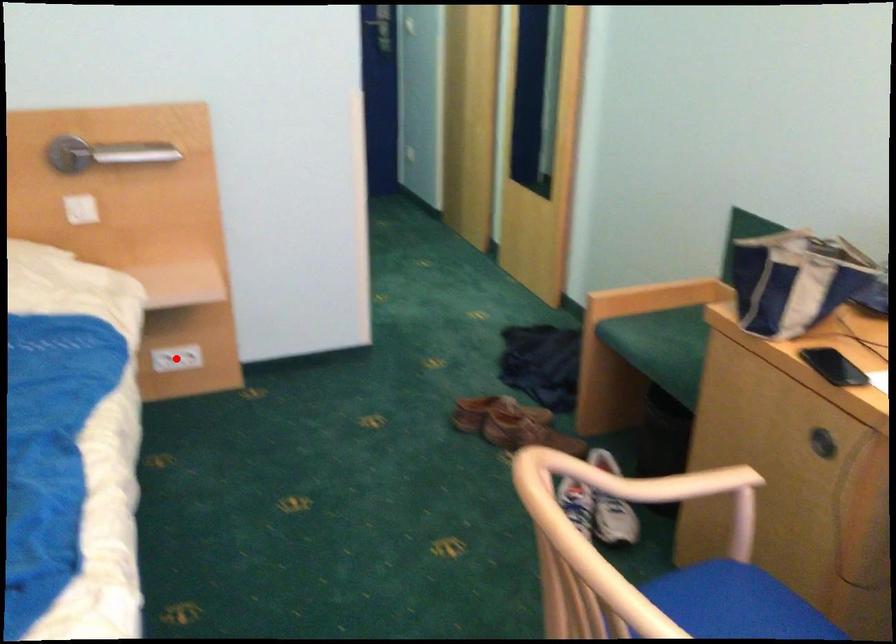
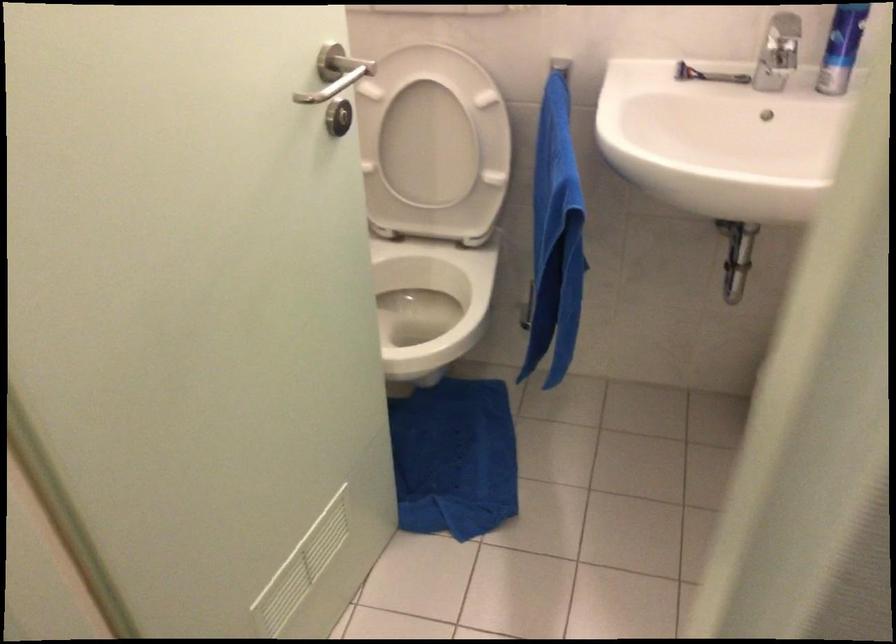
Question: I am providing you with two images of the same scene from different viewpoints. A red point is marked on the first image. At the location where the point appears in image 1, is it still visible in image 2?

Choices:
 (A) Yes
 (B) No

Answer: (B)